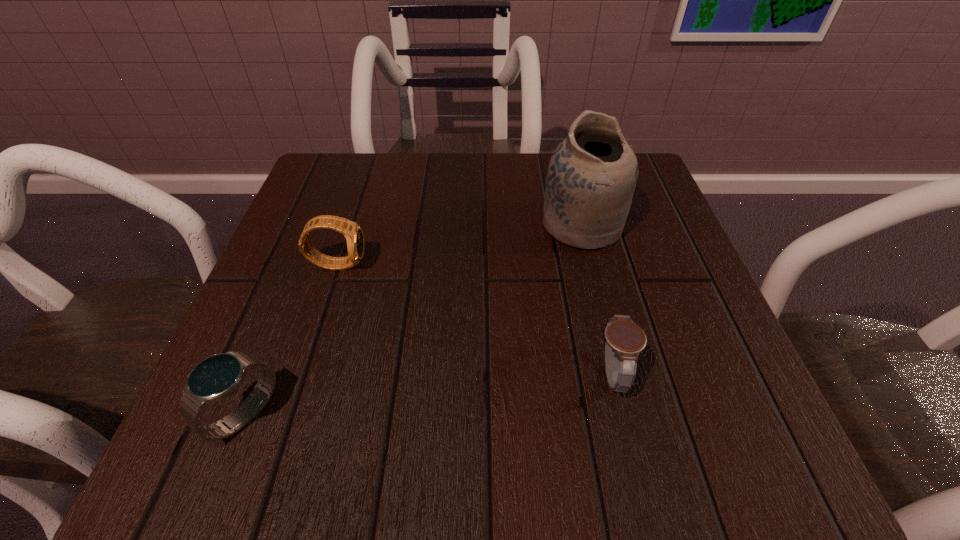
Find the location of a particular element. The width and height of the screenshot is (960, 540). the tallest object is located at coordinates (592, 174).

I want to click on the farthest watch, so click(x=352, y=232).

Locate an element on the screen. Image resolution: width=960 pixels, height=540 pixels. the rightmost watch is located at coordinates (624, 340).

You are a GUI agent. You are given a task and a screenshot of the screen. Output one action in this format:
    pyautogui.click(x=<x>, y=<y>)
    Task: Click on the vacant space located on the front of the pottery
    The height and width of the screenshot is (540, 960).
    Given the screenshot: What is the action you would take?
    pyautogui.click(x=628, y=412)

At what (x,y) coordinates should I click in order to perform the action: click on vacant position located 0.060m on the face of the farthest watch. Please return your answer as a coordinate pair (x, y). Looking at the image, I should click on (399, 264).

Where is `vacant space located on the back of the rightmost watch`? The image size is (960, 540). vacant space located on the back of the rightmost watch is located at coordinates (575, 225).

Identify the location of object that is at the far edge. The width and height of the screenshot is (960, 540). (592, 174).

The width and height of the screenshot is (960, 540). In order to click on object that is at the near edge in this screenshot , I will do `click(217, 377)`.

Find the location of a particular element. pottery present at the right edge is located at coordinates (592, 174).

Find the location of `watch situated at the right edge`. watch situated at the right edge is located at coordinates (624, 340).